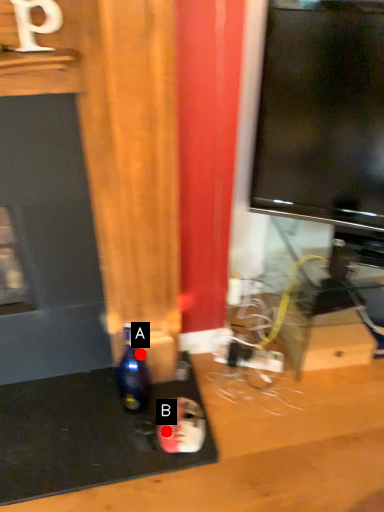
Question: Two points are circled on the image, labeled by A and B beside each circle. Which point is closer to the camera taking this photo?

Choices:
 (A) A is closer
 (B) B is closer

Answer: (B)